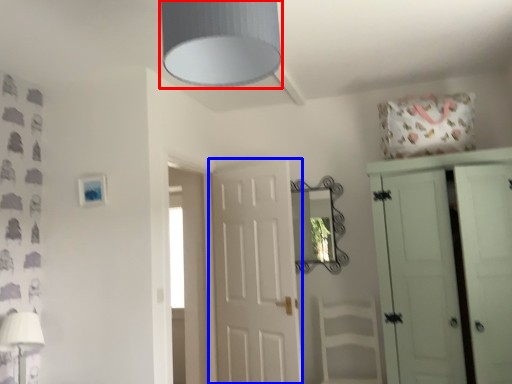
Question: Which object appears farthest to the camera in this image, light fixture (highlighted by a red box) or door (highlighted by a blue box)?

Choices:
 (A) light fixture
 (B) door

Answer: (B)